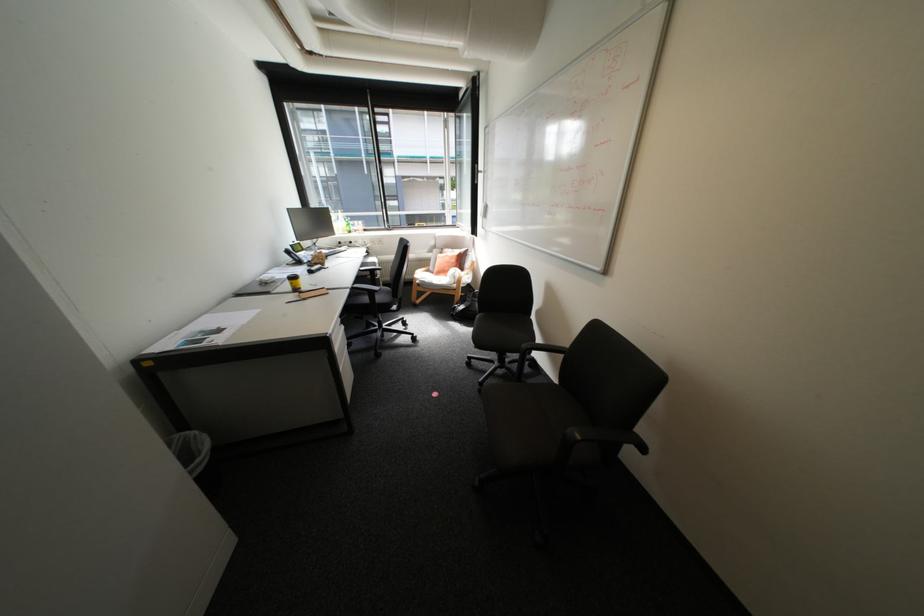
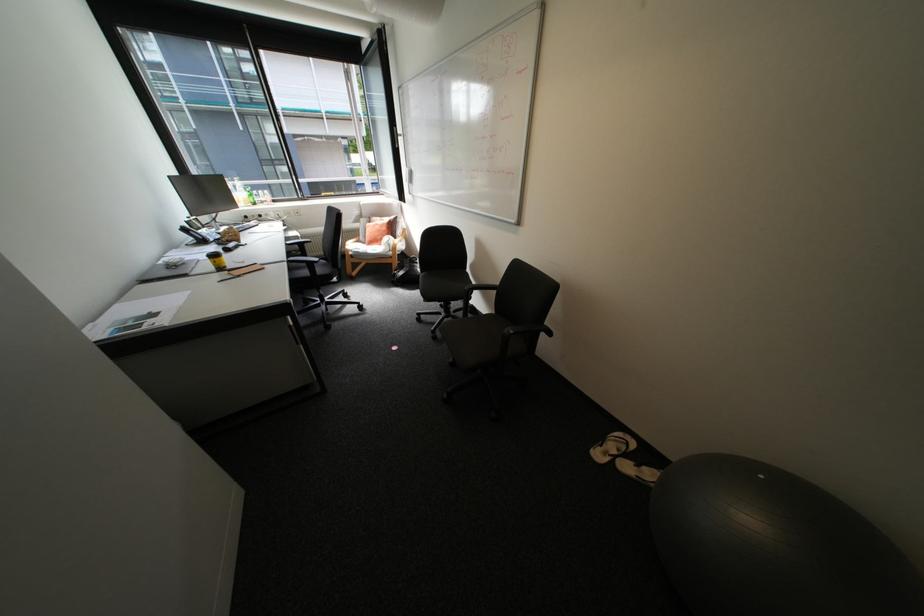
In the second image, find the point that corresponds to point 370,270 in the first image.

(296, 244)